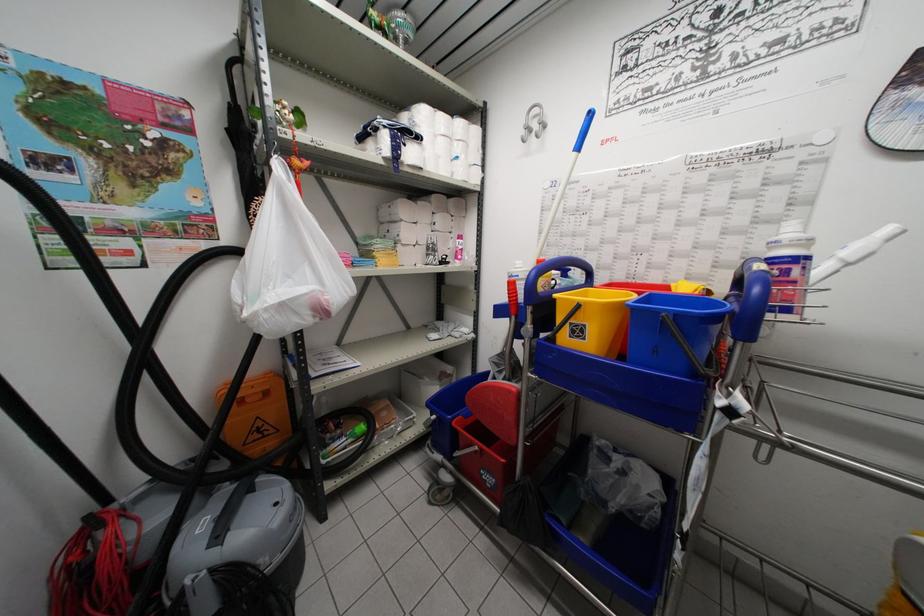
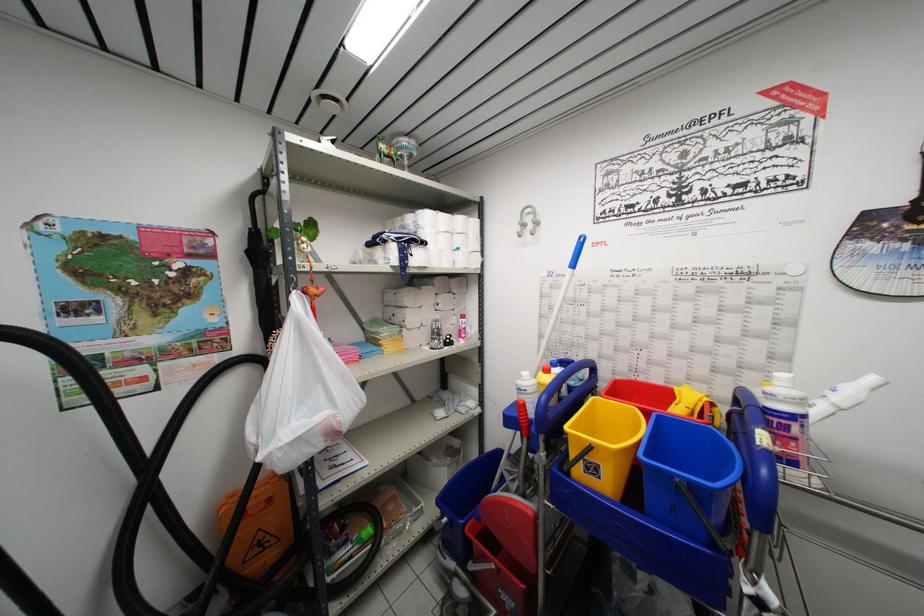
Locate, in the second image, the point that corresponds to (x=439, y=116) in the first image.

(441, 217)